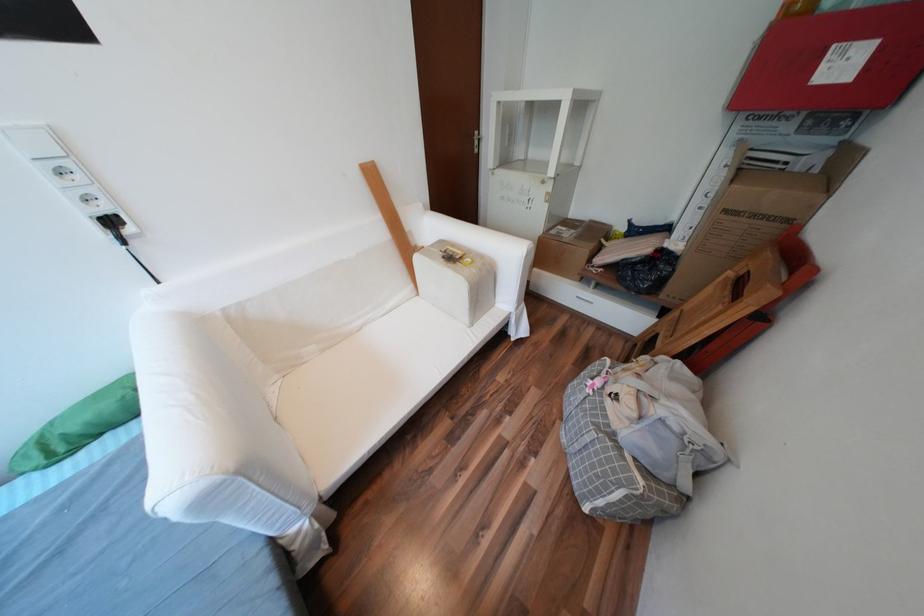
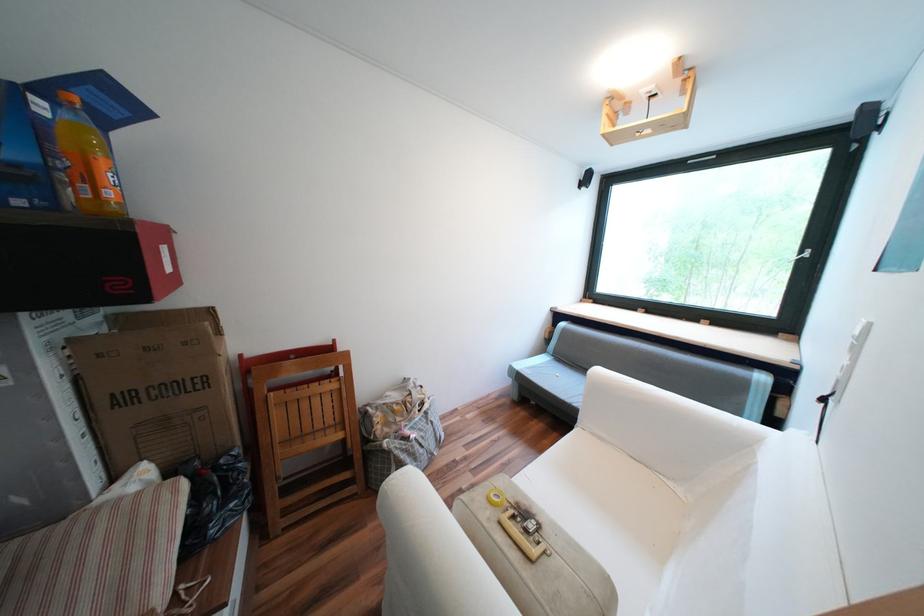
Locate, in the second image, the point that corresponds to (x=561, y=355) in the first image.

(387, 548)